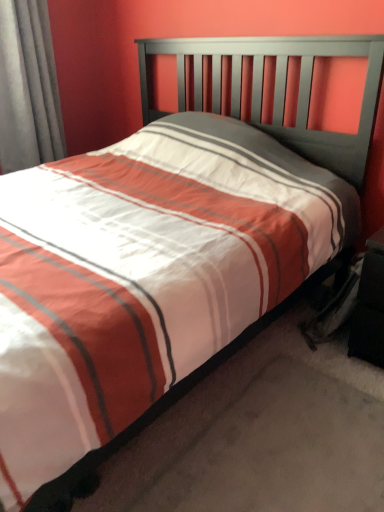
The image size is (384, 512). In order to click on black fabric nightstand at lower right in this screenshot , I will do `click(370, 305)`.

What do you see at coordinates (370, 305) in the screenshot? The height and width of the screenshot is (512, 384). I see `black fabric nightstand at lower right` at bounding box center [370, 305].

In order to face gray fabric curtain at left, should I rotate leftwards or rightwards?

To face it directly, rotate left by 21.352 degrees.

Locate an element on the screen. The image size is (384, 512). gray fabric curtain at left is located at coordinates (28, 87).

What do you see at coordinates (28, 87) in the screenshot? I see `gray fabric curtain at left` at bounding box center [28, 87].

Where is `black fabric nightstand at lower right`? The image size is (384, 512). black fabric nightstand at lower right is located at coordinates (370, 305).

Does black fabric nightstand at lower right appear on the right side of gray fabric curtain at left?

Yes, black fabric nightstand at lower right is to the right of gray fabric curtain at left.

Which object is further away from the camera taking this photo, black fabric nightstand at lower right or gray fabric curtain at left?

Positioned behind is gray fabric curtain at left.

Between point (381, 266) and point (52, 47), which one is positioned in front?

The point (381, 266) is more forward.

From the image's perspective, which one is positioned lower, black fabric nightstand at lower right or gray fabric curtain at left?

black fabric nightstand at lower right appears lower in the image.

From a real-world perspective, which object stands above the other?

gray fabric curtain at left.

Does black fabric nightstand at lower right have a greater width compared to gray fabric curtain at left?

Yes.

In terms of height, does black fabric nightstand at lower right look taller or shorter compared to gray fabric curtain at left?

Clearly, black fabric nightstand at lower right is shorter compared to gray fabric curtain at left.

Can you confirm if black fabric nightstand at lower right is smaller than gray fabric curtain at left?

Correct, black fabric nightstand at lower right occupies less space than gray fabric curtain at left.

Can we say black fabric nightstand at lower right lies outside gray fabric curtain at left?

Yes, black fabric nightstand at lower right is outside of gray fabric curtain at left.

Are black fabric nightstand at lower right and gray fabric curtain at left located far from each other?

black fabric nightstand at lower right is far away from gray fabric curtain at left.

Is gray fabric curtain at left at the back of black fabric nightstand at lower right?

No, black fabric nightstand at lower right is not facing the opposite direction of gray fabric curtain at left.

Image resolution: width=384 pixels, height=512 pixels. There is a black fabric nightstand at lower right. What are the coordinates of `curtain above it (from a real-world perspective)` in the screenshot? It's located at (28, 87).

Considering the positions of objects gray fabric curtain at left and black fabric nightstand at lower right in the image provided, who is more to the right, gray fabric curtain at left or black fabric nightstand at lower right?

From the viewer's perspective, black fabric nightstand at lower right appears more on the right side.

Is gray fabric curtain at left in front of or behind black fabric nightstand at lower right in the image?

Clearly, gray fabric curtain at left is behind black fabric nightstand at lower right.

Is point (14, 139) less distant than point (379, 361)?

No, it is not.

From the image's perspective, which one is positioned lower, gray fabric curtain at left or black fabric nightstand at lower right?

black fabric nightstand at lower right.

From a real-world perspective, is gray fabric curtain at left positioned above or below black fabric nightstand at lower right?

In terms of real-world spatial position, gray fabric curtain at left is above black fabric nightstand at lower right.

Considering the sizes of objects gray fabric curtain at left and black fabric nightstand at lower right in the image provided, who is thinner, gray fabric curtain at left or black fabric nightstand at lower right?

gray fabric curtain at left.

Which of these two, gray fabric curtain at left or black fabric nightstand at lower right, stands shorter?

With less height is black fabric nightstand at lower right.

Considering the sizes of objects gray fabric curtain at left and black fabric nightstand at lower right in the image provided, who is bigger, gray fabric curtain at left or black fabric nightstand at lower right?

With larger size is gray fabric curtain at left.

Is gray fabric curtain at left situated inside black fabric nightstand at lower right or outside?

gray fabric curtain at left is not inside black fabric nightstand at lower right, it's outside.

Is gray fabric curtain at left positioned far away from black fabric nightstand at lower right?

Yes, gray fabric curtain at left and black fabric nightstand at lower right are located far from each other.

Is black fabric nightstand at lower right at the back of gray fabric curtain at left?

That's not correct — gray fabric curtain at left is not looking away from black fabric nightstand at lower right.

What's the angular difference between gray fabric curtain at left and black fabric nightstand at lower right's facing directions?

92.2 degrees separate the facing orientations of gray fabric curtain at left and black fabric nightstand at lower right.

At what (x,y) coordinates should I click in order to perform the action: click on curtain lying above the black fabric nightstand at lower right (from the image's perspective). Please return your answer as a coordinate pair (x, y). The height and width of the screenshot is (512, 384). Looking at the image, I should click on (28, 87).

Locate an element on the screen. The image size is (384, 512). nightstand lying in front of the gray fabric curtain at left is located at coordinates (370, 305).

Identify the location of nightstand below the gray fabric curtain at left (from the image's perspective). (370, 305).